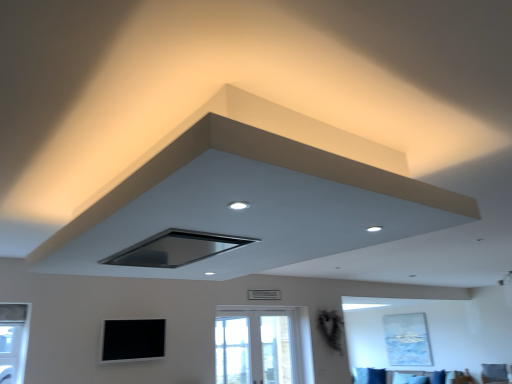
Question: From a real-world perspective, relative to white glass window at center, is black matte window screen at lower center vertically above or below?

Choices:
 (A) below
 (B) above

Answer: (B)

Question: From the image's perspective, is black matte window screen at lower center positioned above or below white glass window at center?

Choices:
 (A) below
 (B) above

Answer: (B)

Question: Estimate the real-world distances between objects in this image. Which object is closer to the black matte exhaust hood at center, positioned as the first exhaust hood in left-to-right order?

Choices:
 (A) velvet blue sofa at lower center
 (B) gray metallic air conditioning unit at center
 (C) matte black exhaust hood at upper center, marked as the 1th exhaust hood in a right-to-left arrangement
 (D) black matte window screen at lower center
 (E) white glass window at center

Answer: (C)

Question: Which object is the farthest from the white glass window at center?

Choices:
 (A) black matte exhaust hood at center, positioned as the first exhaust hood in left-to-right order
 (B) black matte window screen at lower center
 (C) matte black exhaust hood at upper center, marked as the 1th exhaust hood in a right-to-left arrangement
 (D) velvet blue sofa at lower center
 (E) gray metallic air conditioning unit at center

Answer: (A)